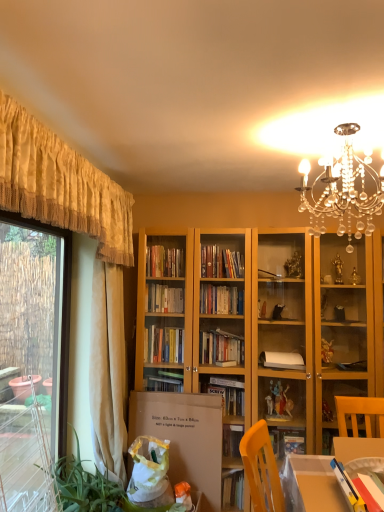
Question: Is beige fabric curtain at left, the first curtain from the back, inside yellow fabric curtain at upper left, the first curtain viewed from the front?

Choices:
 (A) no
 (B) yes

Answer: (A)

Question: Considering the relative sizes of yellow fabric curtain at upper left, the second curtain viewed from the back, and beige fabric curtain at left, the first curtain from the back, in the image provided, is yellow fabric curtain at upper left, the second curtain viewed from the back, shorter than beige fabric curtain at left, the first curtain from the back,?

Choices:
 (A) yes
 (B) no

Answer: (A)

Question: Is the depth of yellow fabric curtain at upper left, the second curtain viewed from the back, less than that of beige fabric curtain at left, which ranks as the second curtain in front-to-back order?

Choices:
 (A) yes
 (B) no

Answer: (A)

Question: Can you confirm if yellow fabric curtain at upper left, the second curtain viewed from the back, is smaller than beige fabric curtain at left, the first curtain from the back?

Choices:
 (A) yes
 (B) no

Answer: (B)

Question: Is yellow fabric curtain at upper left, the second curtain viewed from the back, touching beige fabric curtain at left, the first curtain from the back?

Choices:
 (A) yes
 (B) no

Answer: (B)

Question: Can you confirm if yellow fabric curtain at upper left, the first curtain viewed from the front, is bigger than beige fabric curtain at left, the first curtain from the back?

Choices:
 (A) no
 (B) yes

Answer: (B)

Question: Can you confirm if clear crystal chandelier at upper center is positioned to the left of green leafy plant at lower left?

Choices:
 (A) yes
 (B) no

Answer: (B)

Question: From the image's perspective, does clear crystal chandelier at upper center appear lower than green leafy plant at lower left?

Choices:
 (A) no
 (B) yes

Answer: (A)

Question: From a real-world perspective, is clear crystal chandelier at upper center physically above green leafy plant at lower left?

Choices:
 (A) yes
 (B) no

Answer: (A)

Question: From the image's perspective, is clear crystal chandelier at upper center located above green leafy plant at lower left?

Choices:
 (A) no
 (B) yes

Answer: (B)

Question: Are clear crystal chandelier at upper center and green leafy plant at lower left far apart?

Choices:
 (A) no
 (B) yes

Answer: (B)

Question: Considering the relative positions of clear crystal chandelier at upper center and green leafy plant at lower left in the image provided, is clear crystal chandelier at upper center to the right of green leafy plant at lower left from the viewer's perspective?

Choices:
 (A) yes
 (B) no

Answer: (A)

Question: From a real-world perspective, is beige fabric curtain at left, which ranks as the second curtain in front-to-back order, beneath yellow fabric curtain at upper left, the first curtain viewed from the front?

Choices:
 (A) no
 (B) yes

Answer: (B)